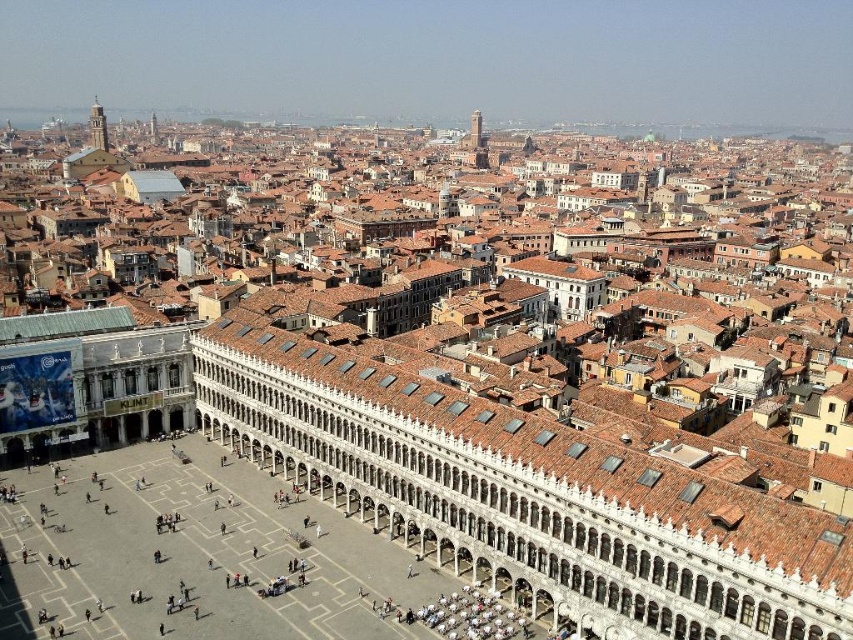
Does smooth white tower at upper left appear over smooth stone tower at upper center?

No, smooth white tower at upper left is not above smooth stone tower at upper center.

Does point (91, 124) lie behind point (473, 116)?

That is False.

I want to click on smooth white tower at upper left, so click(x=97, y=125).